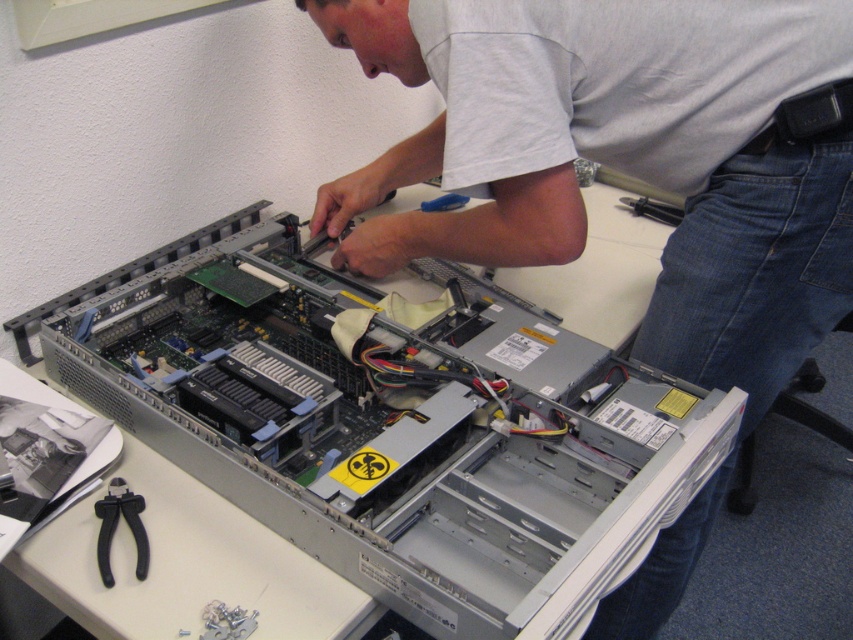
Question: Which object is closer to the camera taking this photo?

Choices:
 (A) silver metallic server at center
 (B) gray matte computer case at center

Answer: (A)

Question: Which object appears farthest from the camera in this image?

Choices:
 (A) black plastic pliers at lower left
 (B) gray matte computer case at center
 (C) silver metallic server at center

Answer: (B)

Question: Does silver metallic server at center have a lesser width compared to gray matte computer case at center?

Choices:
 (A) yes
 (B) no

Answer: (B)

Question: Does silver metallic server at center appear over black plastic pliers at lower left?

Choices:
 (A) yes
 (B) no

Answer: (A)

Question: Considering the real-world distances, which object is closest to the black plastic pliers at lower left?

Choices:
 (A) silver metallic server at center
 (B) gray matte computer case at center

Answer: (A)

Question: Considering the relative positions of silver metallic server at center and black plastic pliers at lower left in the image provided, where is silver metallic server at center located with respect to black plastic pliers at lower left?

Choices:
 (A) right
 (B) left

Answer: (A)